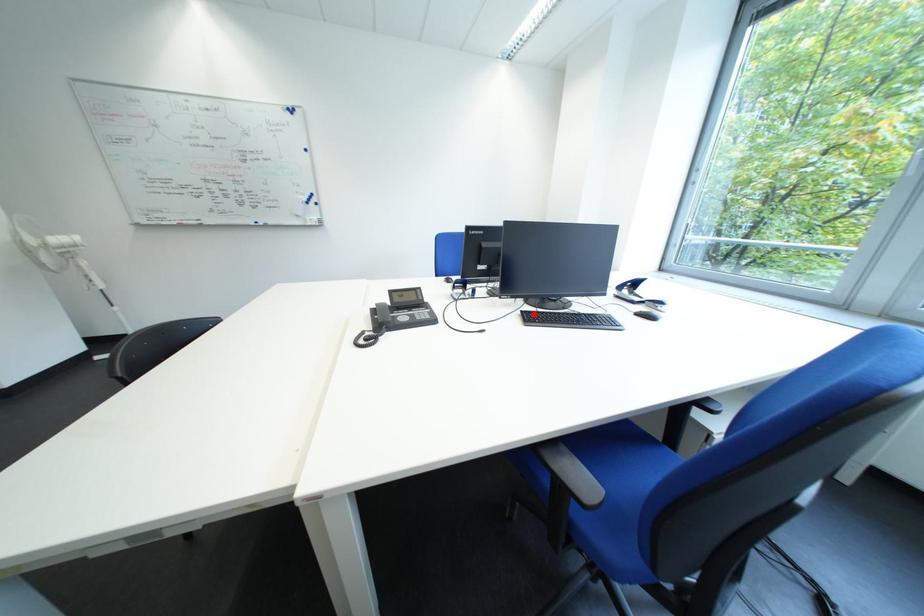
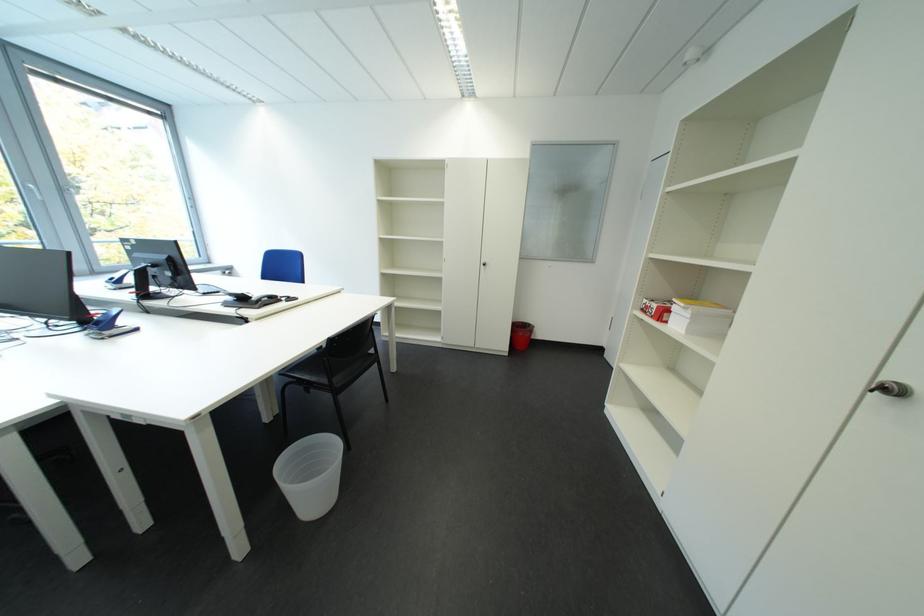
Question: I am providing you with two images of the same scene from different viewpoints. A red point is marked on the first image. At the location where the point appears in image 1, is it still visible in image 2?

Choices:
 (A) Yes
 (B) No

Answer: (B)